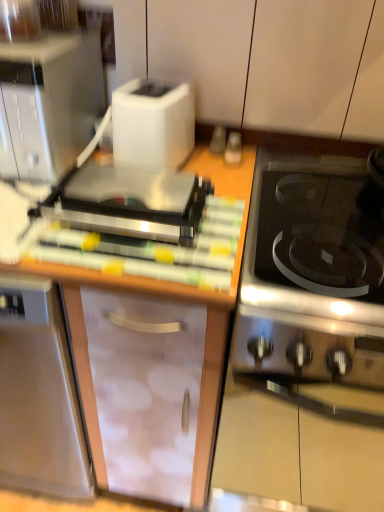
Question: Can you confirm if white matte toaster at upper left, the 1th cabinetry positioned from the top, is thinner than satin silver microwave at upper left?

Choices:
 (A) yes
 (B) no

Answer: (A)

Question: Does white matte toaster at upper left, which appears as the second cabinetry when ordered from the bottom, come in front of satin silver microwave at upper left?

Choices:
 (A) no
 (B) yes

Answer: (A)

Question: Is white matte toaster at upper left, the 1th cabinetry positioned from the top, at the right side of satin silver microwave at upper left?

Choices:
 (A) yes
 (B) no

Answer: (A)

Question: Does white matte toaster at upper left, which appears as the second cabinetry when ordered from the bottom, have a greater width compared to satin silver microwave at upper left?

Choices:
 (A) yes
 (B) no

Answer: (B)

Question: Considering the relative sizes of white matte toaster at upper left, the 1th cabinetry positioned from the top, and satin silver microwave at upper left in the image provided, is white matte toaster at upper left, the 1th cabinetry positioned from the top, taller than satin silver microwave at upper left?

Choices:
 (A) no
 (B) yes

Answer: (B)

Question: Would you say white matte toaster at upper left, the 1th cabinetry positioned from the top, is outside satin silver microwave at upper left?

Choices:
 (A) no
 (B) yes

Answer: (B)

Question: Considering the relative sizes of transparent plastic cabinet at center, which is counted as the 1th cabinetry, starting from the bottom, and satin silver toaster at upper left in the image provided, is transparent plastic cabinet at center, which is counted as the 1th cabinetry, starting from the bottom, wider than satin silver toaster at upper left?

Choices:
 (A) yes
 (B) no

Answer: (A)

Question: Does transparent plastic cabinet at center, which is counted as the 1th cabinetry, starting from the bottom, appear on the right side of satin silver toaster at upper left?

Choices:
 (A) yes
 (B) no

Answer: (B)

Question: Does transparent plastic cabinet at center, which is the second cabinetry from top to bottom, lie behind satin silver toaster at upper left?

Choices:
 (A) no
 (B) yes

Answer: (A)

Question: Can you confirm if transparent plastic cabinet at center, which is the second cabinetry from top to bottom, is shorter than satin silver toaster at upper left?

Choices:
 (A) no
 (B) yes

Answer: (A)

Question: Can you confirm if transparent plastic cabinet at center, which is counted as the 1th cabinetry, starting from the bottom, is thinner than satin silver toaster at upper left?

Choices:
 (A) yes
 (B) no

Answer: (B)

Question: Is transparent plastic cabinet at center, which is counted as the 1th cabinetry, starting from the bottom, aimed at satin silver toaster at upper left?

Choices:
 (A) no
 (B) yes

Answer: (A)

Question: Considering the relative sizes of wooden cutting board at center and black glass cooktop at right in the image provided, is wooden cutting board at center bigger than black glass cooktop at right?

Choices:
 (A) no
 (B) yes

Answer: (A)